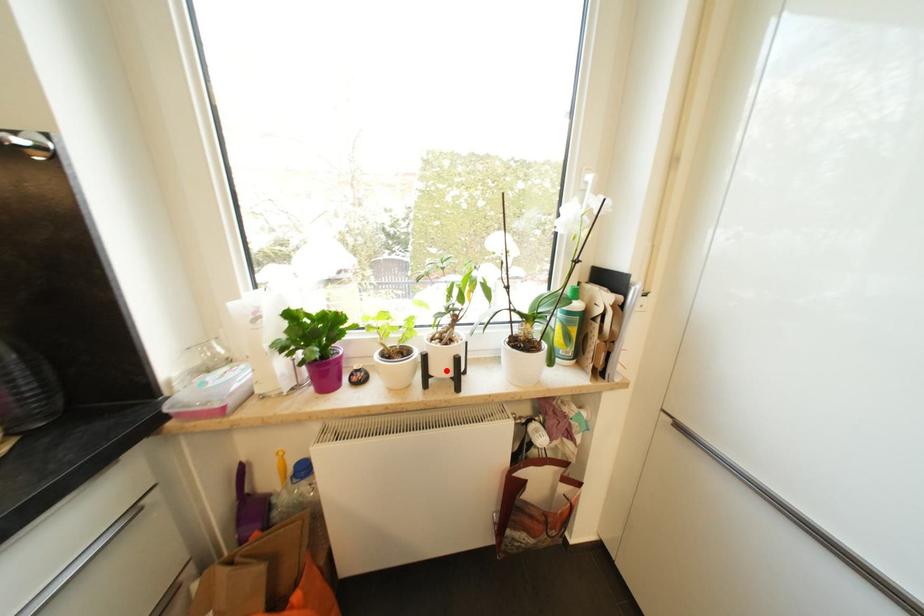
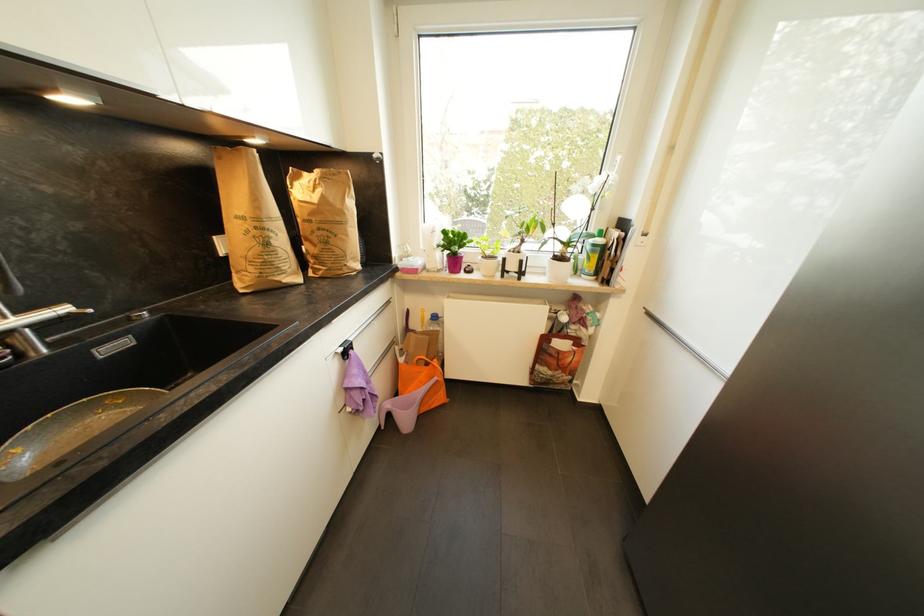
Question: I am providing you with two images of the same scene from different viewpoints. A red point is marked on the first image. At the location where the point appears in image 1, is it still visible in image 2?

Choices:
 (A) Yes
 (B) No

Answer: (A)